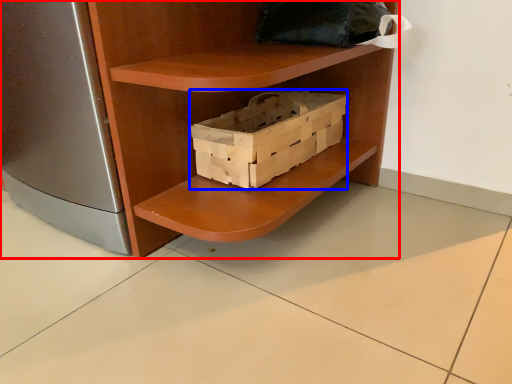
Question: Which object appears closest to the camera in this image, shelf (highlighted by a red box) or box (highlighted by a blue box)?

Choices:
 (A) shelf
 (B) box

Answer: (A)